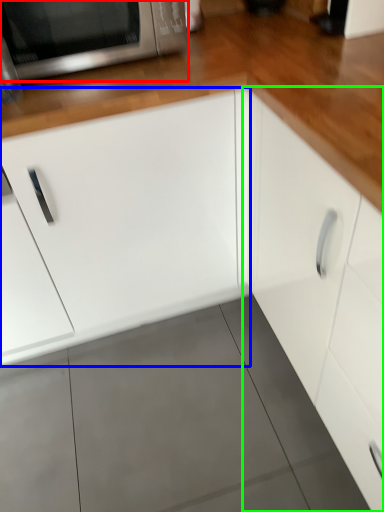
Question: Considering the real-world distances, which object is closest to microwave oven (highlighted by a red box)? cabinetry (highlighted by a blue box) or cabinetry (highlighted by a green box).

Choices:
 (A) cabinetry
 (B) cabinetry

Answer: (A)